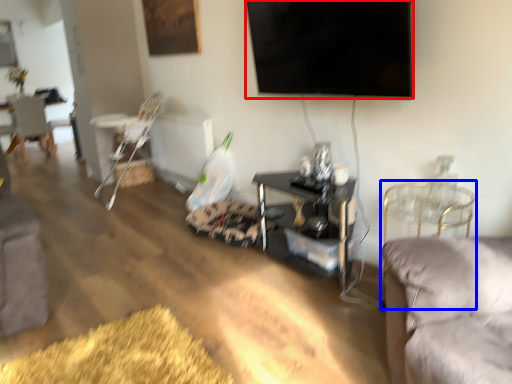
Question: Which object appears farthest to the camera in this image, television (highlighted by a red box) or chair (highlighted by a blue box)?

Choices:
 (A) television
 (B) chair

Answer: (B)